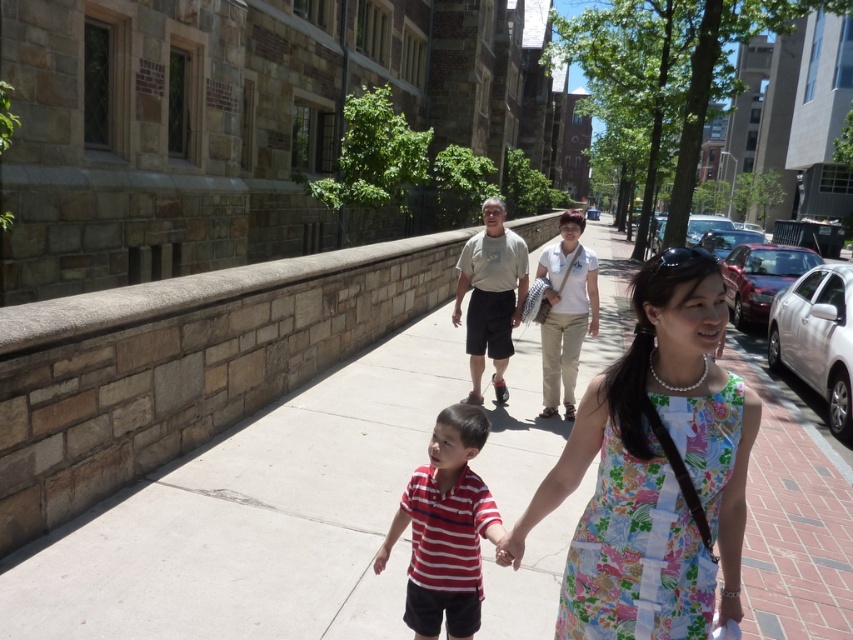
Which of these two, floral fabric dress at center or striped cotton shirt at center, stands shorter?

Standing shorter between the two is striped cotton shirt at center.

Is floral fabric dress at center wider than striped cotton shirt at center?

Indeed, floral fabric dress at center has a greater width compared to striped cotton shirt at center.

Is point (737, 605) positioned before point (451, 436)?

Yes, point (737, 605) is closer to viewer.

Locate an element on the screen. This screenshot has width=853, height=640. floral fabric dress at center is located at coordinates (654, 468).

Measure the distance between point (x=532, y=460) and camera.

Point (x=532, y=460) is 5.58 meters from camera.

Does concrete at center appear over light gray t-shirt at center?

Incorrect, concrete at center is not positioned above light gray t-shirt at center.

The height and width of the screenshot is (640, 853). In order to click on concrete at center in this screenshot , I will do `click(254, 516)`.

Find the location of a particular element. This screenshot has width=853, height=640. concrete at center is located at coordinates (254, 516).

Who is lower down, floral fabric dress at center or light gray t-shirt at center?

floral fabric dress at center is below.

Does floral fabric dress at center appear on the right side of light gray t-shirt at center?

Yes, floral fabric dress at center is to the right of light gray t-shirt at center.

I want to click on floral fabric dress at center, so click(x=654, y=468).

Where is `floral fabric dress at center`? The width and height of the screenshot is (853, 640). floral fabric dress at center is located at coordinates (654, 468).